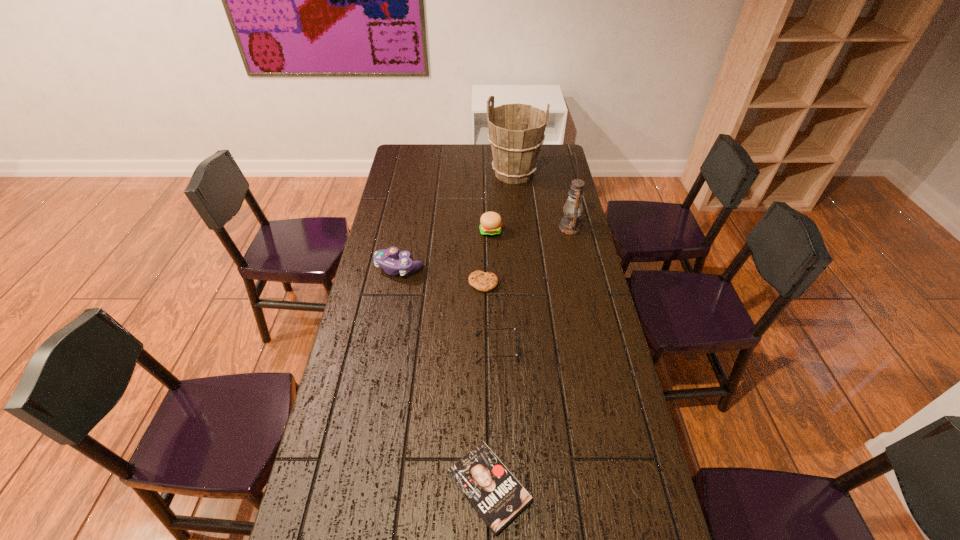
This screenshot has width=960, height=540. In order to click on oil lamp at the right edge in this screenshot , I will do `click(570, 224)`.

You are a GUI agent. You are given a task and a screenshot of the screen. Output one action in this format:
    pyautogui.click(x=<x>, y=<y>)
    Task: Click on the object located at the far right corner
    Image resolution: width=960 pixels, height=540 pixels.
    Given the screenshot: What is the action you would take?
    pyautogui.click(x=516, y=131)

The width and height of the screenshot is (960, 540). I want to click on vacant space at the far edge of the desktop, so click(467, 160).

The height and width of the screenshot is (540, 960). I want to click on vacant space at the left edge of the desktop, so click(385, 217).

I want to click on vacant space at the right edge of the desktop, so click(x=589, y=333).

What are the coordinates of `free space between the oil lamp and the leftmost object` in the screenshot? It's located at (485, 247).

Locate an element on the screen. The width and height of the screenshot is (960, 540). vacant area that lies between the leftmost object and the farthest object is located at coordinates (457, 220).

In order to click on vacant space that is in between the spectacles and the book in this screenshot , I will do `click(492, 418)`.

This screenshot has height=540, width=960. In order to click on vacant region between the book and the rightmost object in this screenshot , I will do `click(529, 357)`.

This screenshot has height=540, width=960. I want to click on vacant point located between the book and the oil lamp, so click(x=529, y=357).